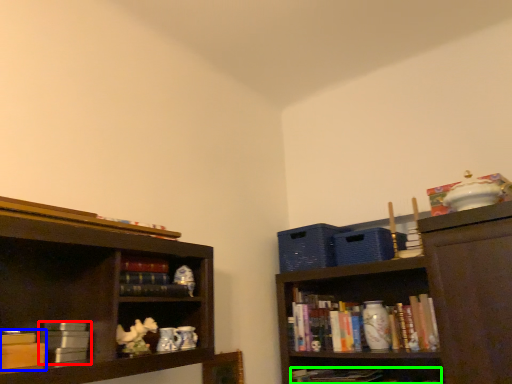
Question: Which is farther away from book (highlighted by a red box)? book (highlighted by a blue box) or book (highlighted by a green box)?

Choices:
 (A) book
 (B) book

Answer: (B)